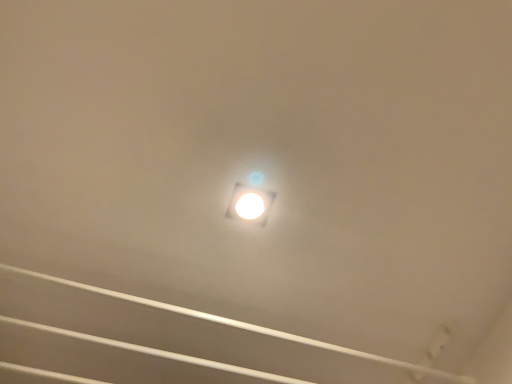
I want to click on white glossy light fixture at center, so click(250, 204).

The width and height of the screenshot is (512, 384). What do you see at coordinates (250, 204) in the screenshot?
I see `white glossy light fixture at center` at bounding box center [250, 204].

In order to click on white glossy light fixture at center in this screenshot , I will do `click(250, 204)`.